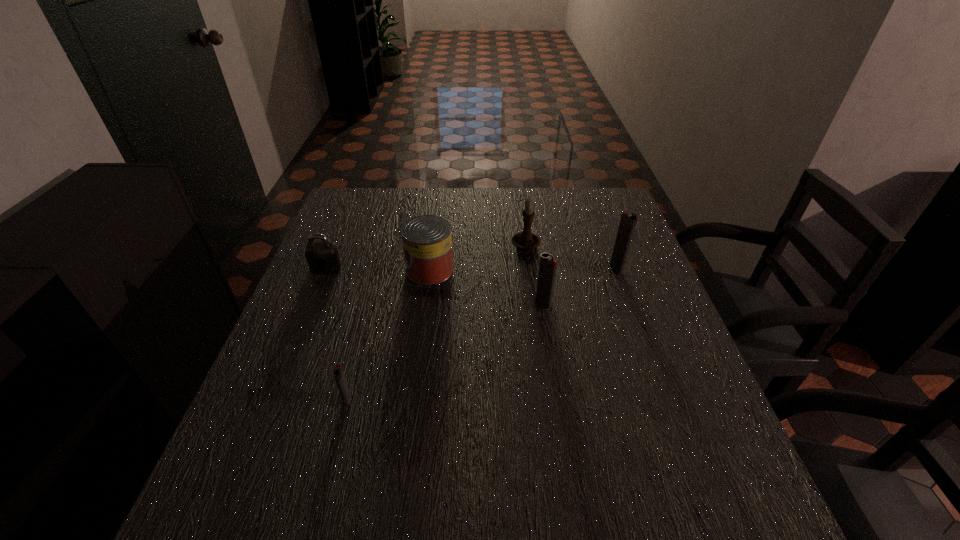
Where is `the shortest igniter`? The image size is (960, 540). the shortest igniter is located at coordinates (338, 372).

At what (x,y) coordinates should I click in order to perform the action: click on the leftmost igniter. Please return your answer as a coordinate pair (x, y). Looking at the image, I should click on (338, 372).

Where is `the second nearest igniter`? The width and height of the screenshot is (960, 540). the second nearest igniter is located at coordinates (548, 265).

Image resolution: width=960 pixels, height=540 pixels. I want to click on the second nearest object, so click(x=548, y=265).

Identify the location of the farthest igniter. (628, 221).

At what (x,y) coordinates should I click in order to perform the action: click on the rightmost object. Please return your answer as a coordinate pair (x, y). This screenshot has width=960, height=540. Looking at the image, I should click on (628, 221).

This screenshot has height=540, width=960. Find the location of `padlock`. padlock is located at coordinates (322, 257).

Where is `the third object from left to right`? This screenshot has height=540, width=960. the third object from left to right is located at coordinates (427, 242).

What are the coordinates of `candle holder` in the screenshot? It's located at tap(526, 240).

The width and height of the screenshot is (960, 540). What are the coordinates of `vacant region located 0.130m on the left of the shortest igniter` in the screenshot? It's located at (278, 400).